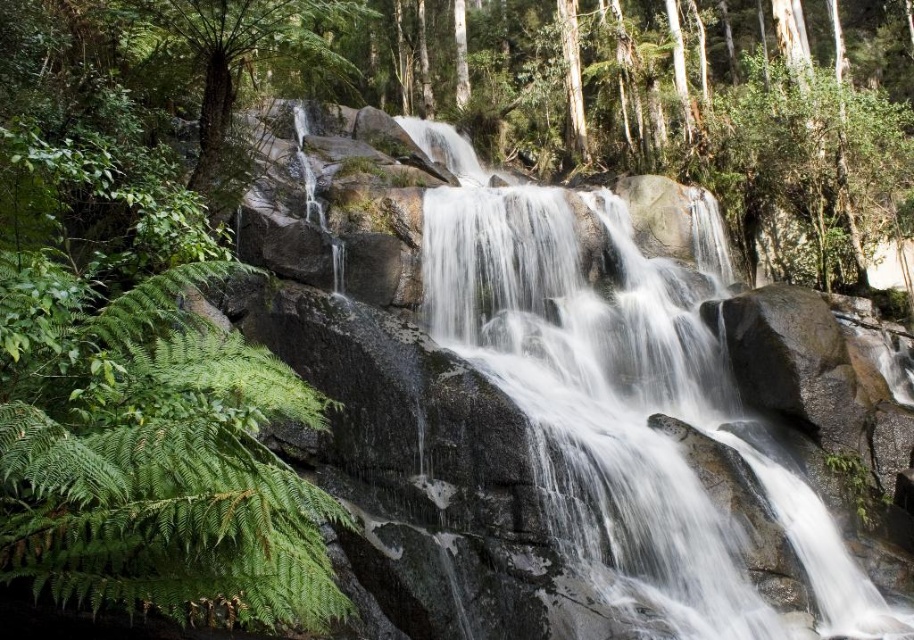
Question: Does smooth gray rock at center appear over green leafy tree at left?

Choices:
 (A) yes
 (B) no

Answer: (B)

Question: Which point is farther from the camera taking this photo?

Choices:
 (A) (14, 467)
 (B) (650, 285)

Answer: (B)

Question: Which object is closer to the camera taking this photo?

Choices:
 (A) smooth gray rock at center
 (B) green leafy fern at left
 (C) green leafy tree at left

Answer: (B)

Question: Estimate the real-world distances between objects in this image. Which object is closer to the green leafy fern at left?

Choices:
 (A) green leafy tree at left
 (B) smooth gray rock at center

Answer: (A)

Question: Considering the relative positions of smooth gray rock at center and green leafy tree at left in the image provided, where is smooth gray rock at center located with respect to green leafy tree at left?

Choices:
 (A) above
 (B) below

Answer: (B)

Question: Is smooth gray rock at center to the right of green leafy fern at left from the viewer's perspective?

Choices:
 (A) no
 (B) yes

Answer: (B)